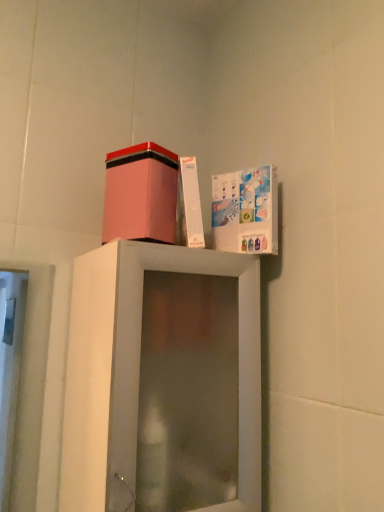
Question: Is pink matte cardboard box at upper center wider than white cardboard box at upper right?

Choices:
 (A) yes
 (B) no

Answer: (A)

Question: Is pink matte cardboard box at upper center positioned with its back to white cardboard box at upper right?

Choices:
 (A) no
 (B) yes

Answer: (A)

Question: From a real-world perspective, is pink matte cardboard box at upper center positioned over white cardboard box at upper right based on gravity?

Choices:
 (A) yes
 (B) no

Answer: (A)

Question: Is the position of pink matte cardboard box at upper center more distant than that of white cardboard box at upper right?

Choices:
 (A) yes
 (B) no

Answer: (B)

Question: Is pink matte cardboard box at upper center shorter than white cardboard box at upper right?

Choices:
 (A) yes
 (B) no

Answer: (A)

Question: Is pink matte cardboard box at upper center far away from white cardboard box at upper right?

Choices:
 (A) no
 (B) yes

Answer: (A)

Question: Is white cardboard box at upper right next to pink matte cardboard box at upper center?

Choices:
 (A) no
 (B) yes

Answer: (A)

Question: From a real-world perspective, is white cardboard box at upper right positioned over pink matte cardboard box at upper center based on gravity?

Choices:
 (A) yes
 (B) no

Answer: (B)

Question: From the image's perspective, is white cardboard box at upper right located beneath pink matte cardboard box at upper center?

Choices:
 (A) no
 (B) yes

Answer: (B)

Question: Can you confirm if white cardboard box at upper right is shorter than pink matte cardboard box at upper center?

Choices:
 (A) no
 (B) yes

Answer: (A)

Question: Is white cardboard box at upper right bigger than pink matte cardboard box at upper center?

Choices:
 (A) yes
 (B) no

Answer: (B)

Question: From a real-world perspective, is white cardboard box at upper right physically below pink matte cardboard box at upper center?

Choices:
 (A) no
 (B) yes

Answer: (B)

Question: Is pink matte cardboard box at upper center bigger or smaller than white cardboard box at upper right?

Choices:
 (A) big
 (B) small

Answer: (A)